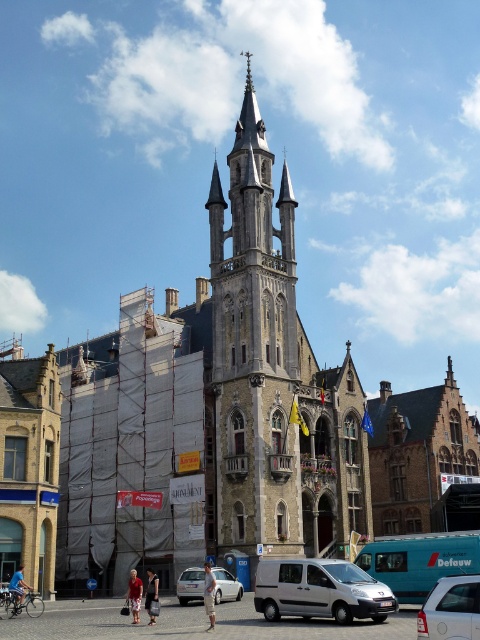
Between silver metallic hatchback at center and blue denim shorts at center, which one is positioned higher?

blue denim shorts at center is above.

Which is behind, point (181, 600) or point (16, 596)?

Point (181, 600)

This screenshot has height=640, width=480. What are the coordinates of `silver metallic hatchback at center` in the screenshot? It's located at (190, 584).

I want to click on silver metallic hatchback at center, so click(x=190, y=584).

Which is below, light brown leather pants at center or denim shorts at lower center?

Positioned lower is denim shorts at lower center.

Between point (211, 625) and point (152, 577), which one is positioned in front?

Point (211, 625) is in front.

Identify the location of light brown leather pants at center. The image size is (480, 640). (208, 595).

Can you confirm if stone tower at center is thinner than silver metallic van at center?

In fact, stone tower at center might be wider than silver metallic van at center.

Does stone tower at center have a smaller size compared to silver metallic van at center?

Actually, stone tower at center might be larger than silver metallic van at center.

Based on the photo, measure the distance between stone tower at center and camera.

189.71 feet

Where is `stone tower at center`? stone tower at center is located at coordinates (276, 378).